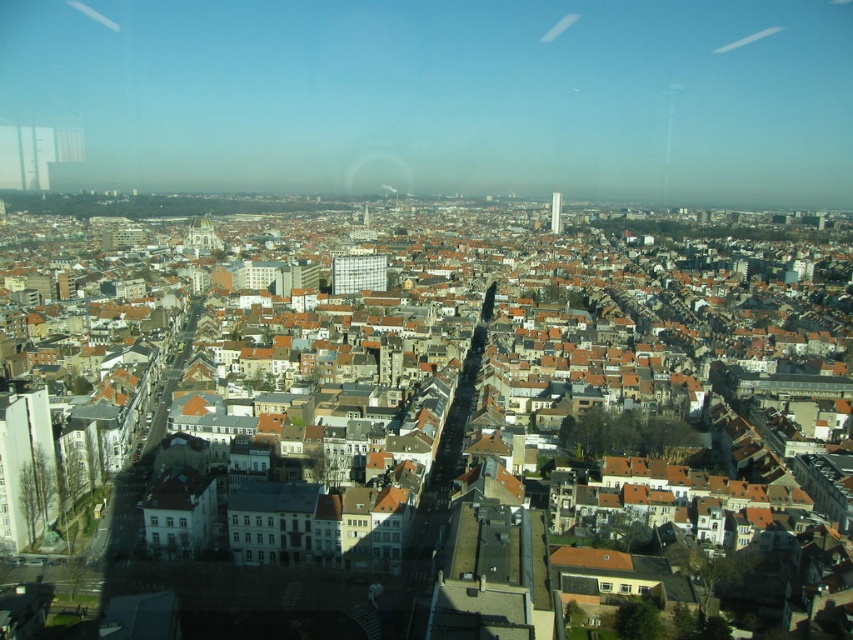
You are a GUI agent. You are given a task and a screenshot of the screen. Output one action in this format:
    pyautogui.click(x=<x>, y=<y>)
    Task: Click on the matte glass building at center
    
    Given the screenshot: What is the action you would take?
    pyautogui.click(x=358, y=273)

Image resolution: width=853 pixels, height=640 pixels. What do you see at coordinates (358, 273) in the screenshot?
I see `matte glass building at center` at bounding box center [358, 273].

This screenshot has height=640, width=853. In order to click on matte glass building at center in this screenshot , I will do `click(358, 273)`.

Is white glass tower at center above transparent glass window at lower left?

Yes.

Which is behind, point (555, 204) or point (154, 518)?

Positioned behind is point (555, 204).

Which is behind, point (558, 221) or point (151, 525)?

The point (558, 221) is behind.

In order to click on white glass tower at center in this screenshot , I will do `click(555, 212)`.

Which is more to the right, matte glass building at center or transparent glass window at lower left?

From the viewer's perspective, matte glass building at center appears more on the right side.

Is point (345, 292) closer to viewer compared to point (151, 525)?

No, it is behind (151, 525).

Does point (355, 276) come in front of point (152, 520)?

No, it is behind (152, 520).

I want to click on matte glass building at center, so click(358, 273).